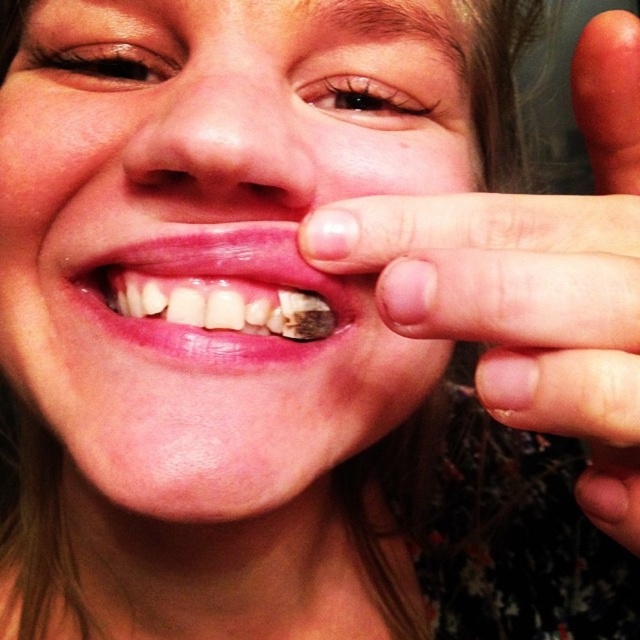
Can you confirm if smooth skin at center is positioned above brown matte tooth at center?

Actually, smooth skin at center is below brown matte tooth at center.

Can you confirm if smooth skin at center is shorter than brown matte tooth at center?

No, smooth skin at center is not shorter than brown matte tooth at center.

Image resolution: width=640 pixels, height=640 pixels. What do you see at coordinates (228, 284) in the screenshot?
I see `smooth skin at center` at bounding box center [228, 284].

Identify the location of smooth skin at center. click(228, 284).

You are a GUI agent. You are given a task and a screenshot of the screen. Output one action in this format:
    pyautogui.click(x=<x>, y=<y>)
    Task: Click on the smooth skin at center
    The height and width of the screenshot is (640, 640).
    Given the screenshot: What is the action you would take?
    pyautogui.click(x=228, y=284)

Locate an element on the screen. The width and height of the screenshot is (640, 640). smooth skin at center is located at coordinates (228, 284).

Is point (621, 324) positioned before point (145, 288)?

Yes, it is.

Does point (365, 266) come behind point (150, 346)?

No.

Who is more distant from viewer, (572,381) or (230,294)?

Positioned behind is point (230,294).

This screenshot has width=640, height=640. I want to click on smooth skin hand at right, so click(531, 282).